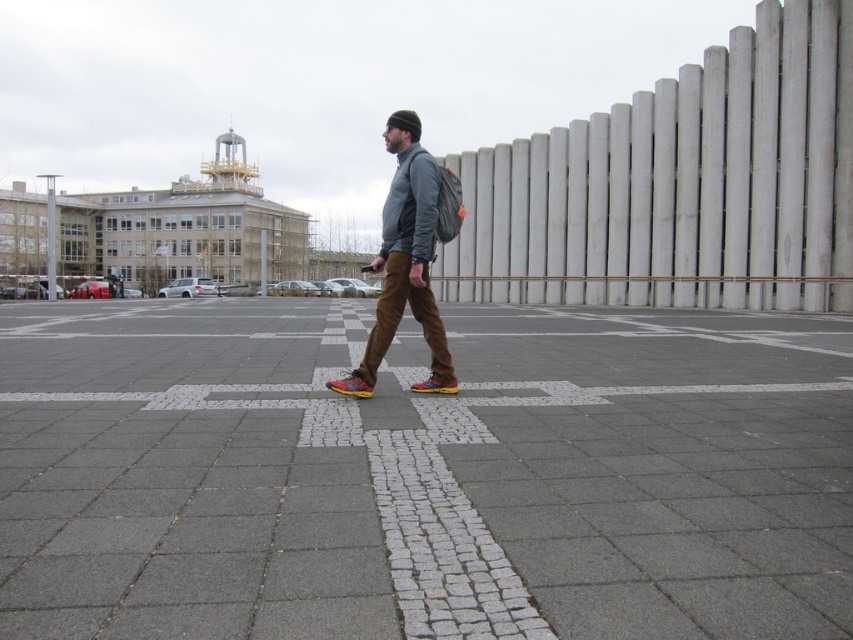
Question: Among these points, which one is farthest from the camera?

Choices:
 (A) (341, 388)
 (B) (386, 305)

Answer: (A)

Question: Is gray cobblestone pavement at center to the right of matte gray jacket at center from the viewer's perspective?

Choices:
 (A) no
 (B) yes

Answer: (B)

Question: Which object is the farthest from the gray cobblestone pavement at center?

Choices:
 (A) multicolored synthetic shoe at center
 (B) multicolored leather shoe at center

Answer: (B)

Question: Is gray cobblestone pavement at center in front of multicolored leather shoe at center?

Choices:
 (A) no
 (B) yes

Answer: (B)

Question: Which object appears closest to the camera in this image?

Choices:
 (A) gray cobblestone pavement at center
 (B) multicolored leather shoe at center

Answer: (A)

Question: Is matte gray jacket at center bigger than multicolored synthetic shoe at center?

Choices:
 (A) no
 (B) yes

Answer: (B)